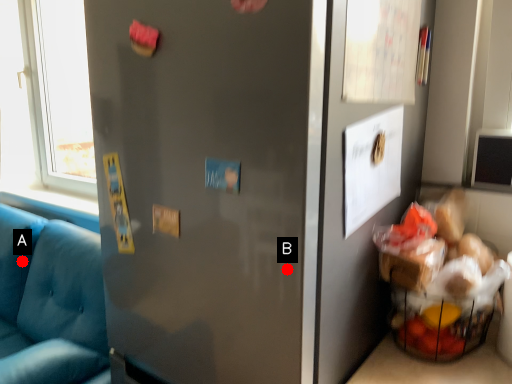
Question: Two points are circled on the image, labeled by A and B beside each circle. Which point is closer to the camera taking this photo?

Choices:
 (A) A is closer
 (B) B is closer

Answer: (B)